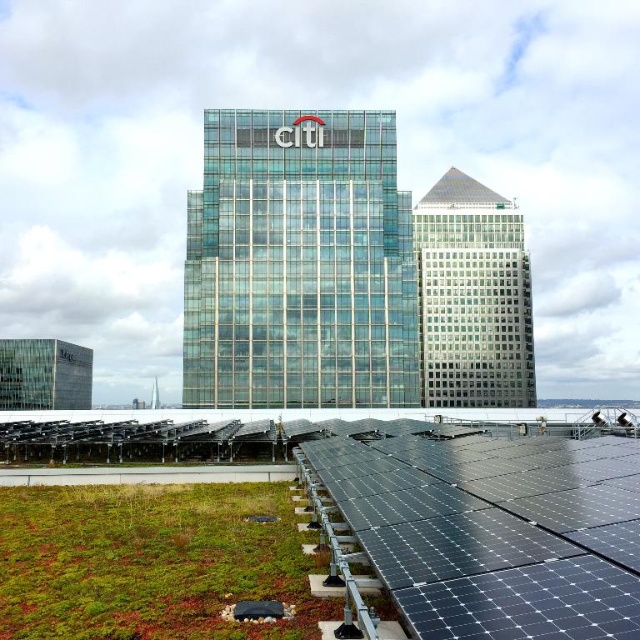
You are a drone operator trying to navigate between the green mossy roof at lower left and the transparent glass pyramid at upper center. Which object is located to the left of the other?

The green mossy roof at lower left is positioned on the left side of transparent glass pyramid at upper center, so the green mossy roof at lower left is to the left of the transparent glass pyramid at upper center.

You are an architect designing a new city park. You want to place a small garden on the green mossy roof at lower left and a large sculpture on the transparent glass pyramid at upper center. Based on the available space, will both projects fit appropriately?

The green mossy roof at lower left occupies less space than the transparent glass pyramid at upper center. Therefore, the small garden on the green mossy roof at lower left is suitable, but the large sculpture on the transparent glass pyramid at upper center may require more space than available unless the sculpture is scaled down.